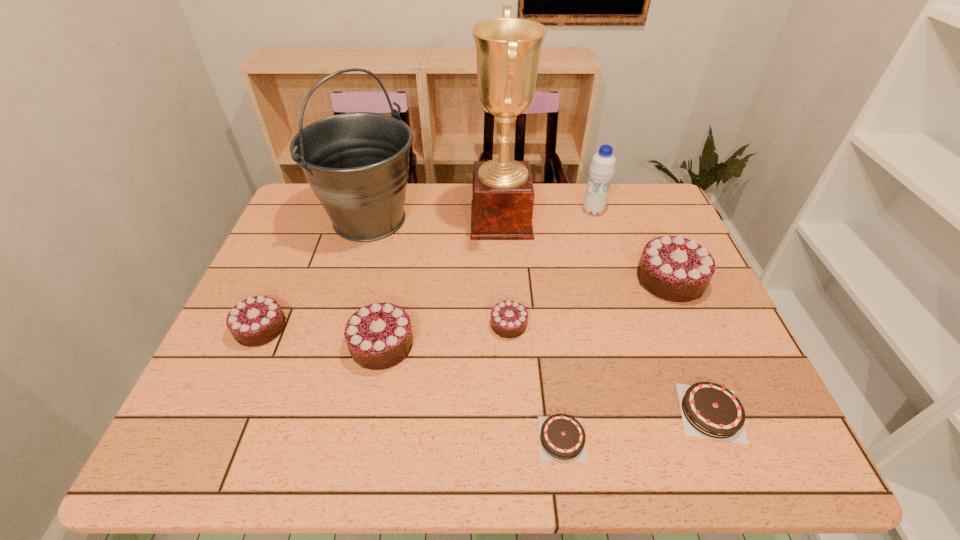
Where is `free space located on the front of the gray bucket`? free space located on the front of the gray bucket is located at coordinates (331, 353).

Where is `vacant space positioned on the front of the water bottle`? The height and width of the screenshot is (540, 960). vacant space positioned on the front of the water bottle is located at coordinates (600, 232).

At what (x,y) coordinates should I click in order to perform the action: click on vacant space located on the back of the farthest chocolate chocolate cake. Please return your answer as a coordinate pair (x, y). The width and height of the screenshot is (960, 540). Looking at the image, I should click on (630, 185).

Identify the location of vacant region located on the left of the second chocolate chocolate cake from left to right. This screenshot has height=540, width=960. (238, 344).

This screenshot has height=540, width=960. What are the coordinates of `vacant area located 0.160m on the back of the leftmost chocolate chocolate cake` in the screenshot? It's located at (288, 265).

At what (x,y) coordinates should I click in order to perform the action: click on free point located on the back of the smallest chocolate chocolate cake. Please return your answer as a coordinate pair (x, y). Looking at the image, I should click on (506, 272).

You are a GUI agent. You are given a task and a screenshot of the screen. Output one action in this format:
    pyautogui.click(x=<x>, y=<y>)
    Task: Click on the vacant space located on the left of the right brown chocolate cake
    This screenshot has height=540, width=960.
    Given the screenshot: What is the action you would take?
    pyautogui.click(x=595, y=412)

Where is `vacant region located on the back of the shortest chocolate cake`? The width and height of the screenshot is (960, 540). vacant region located on the back of the shortest chocolate cake is located at coordinates pos(540,281).

At what (x,y) coordinates should I click in order to perform the action: click on trophy cup present at the far edge. Please return your answer as a coordinate pair (x, y). Looking at the image, I should click on (293, 436).

This screenshot has width=960, height=540. I want to click on bucket at the far edge, so click(293, 436).